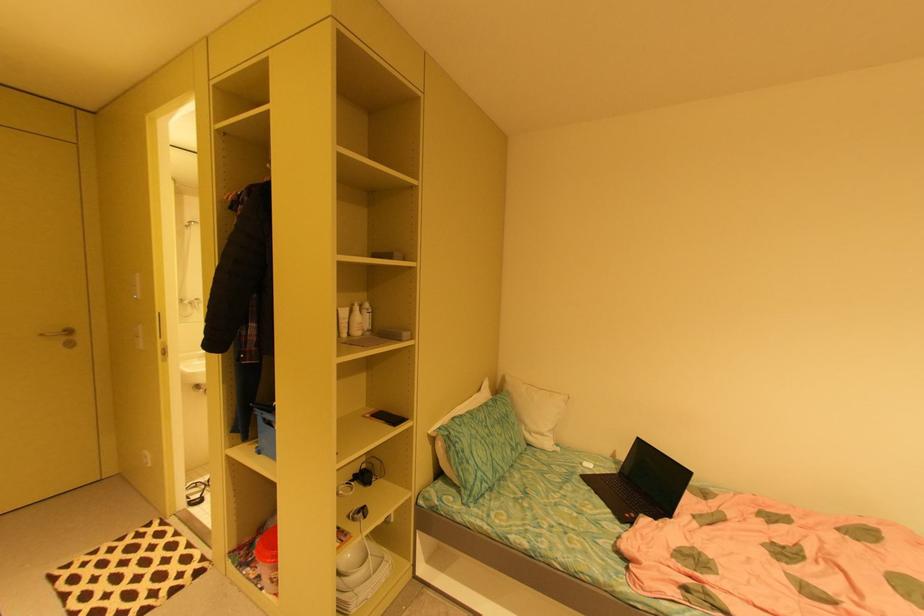
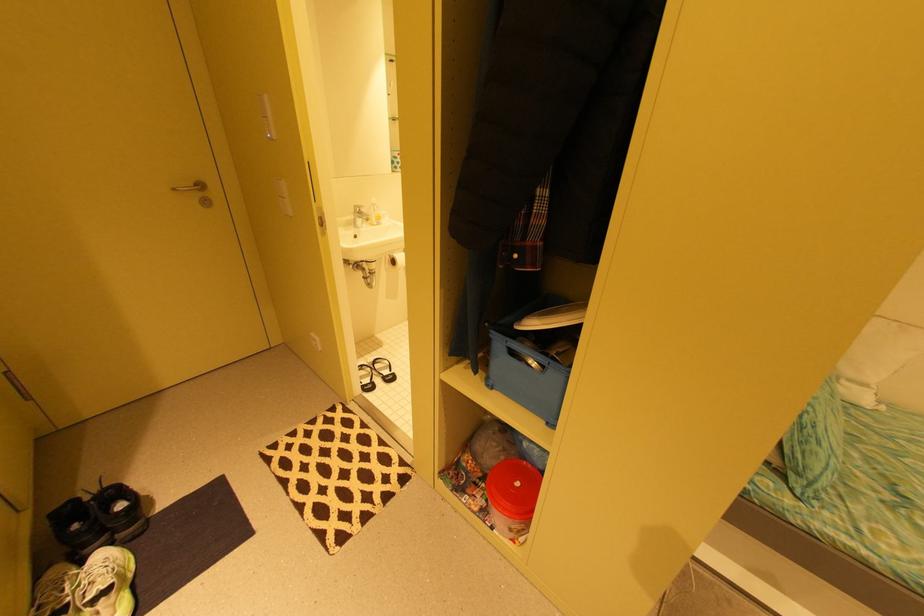
In the second image, find the point that corresponds to pixel 49 334 in the first image.

(179, 190)